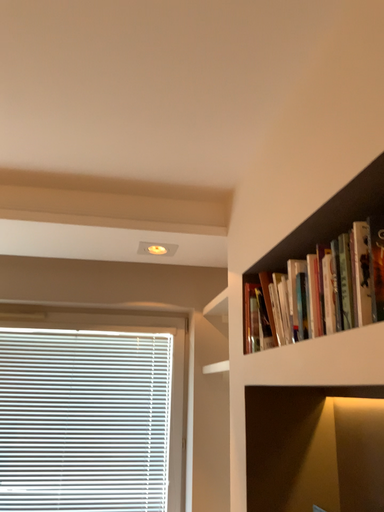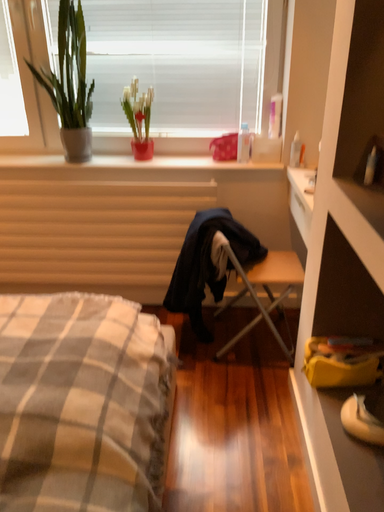
Question: Which way did the camera rotate in the video?

Choices:
 (A) rotated right
 (B) rotated left

Answer: (B)